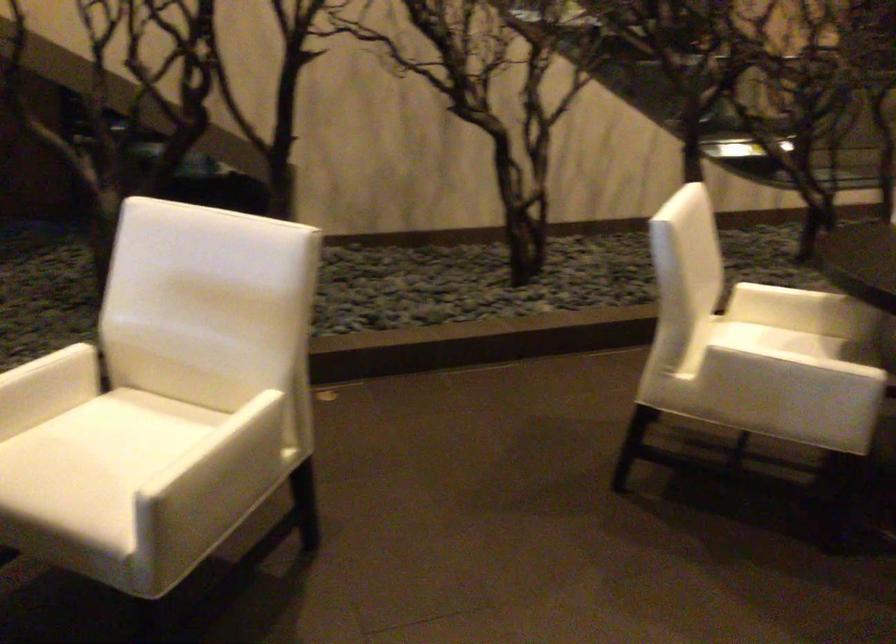
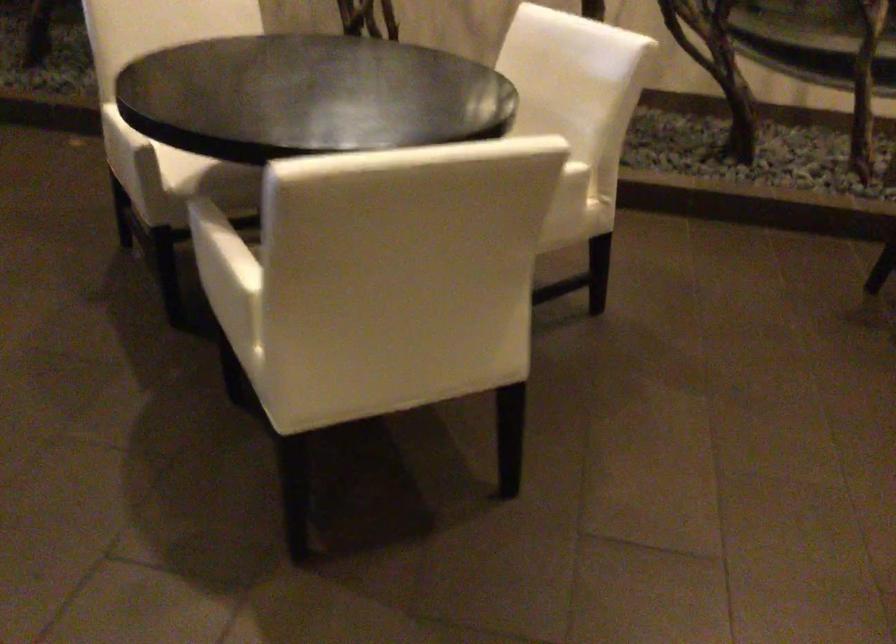
In the second image, find the point that corresponds to point 814,375 in the first image.

(118, 138)